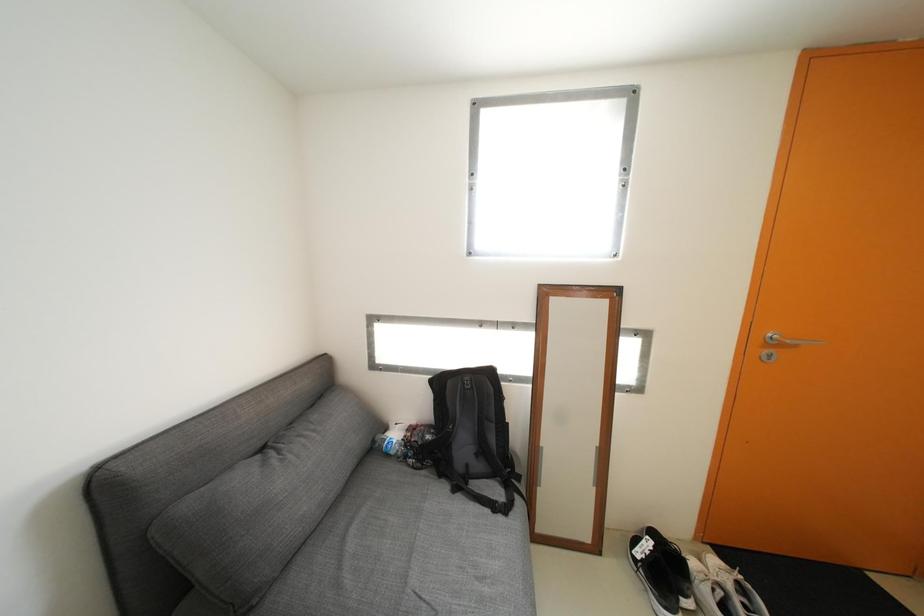
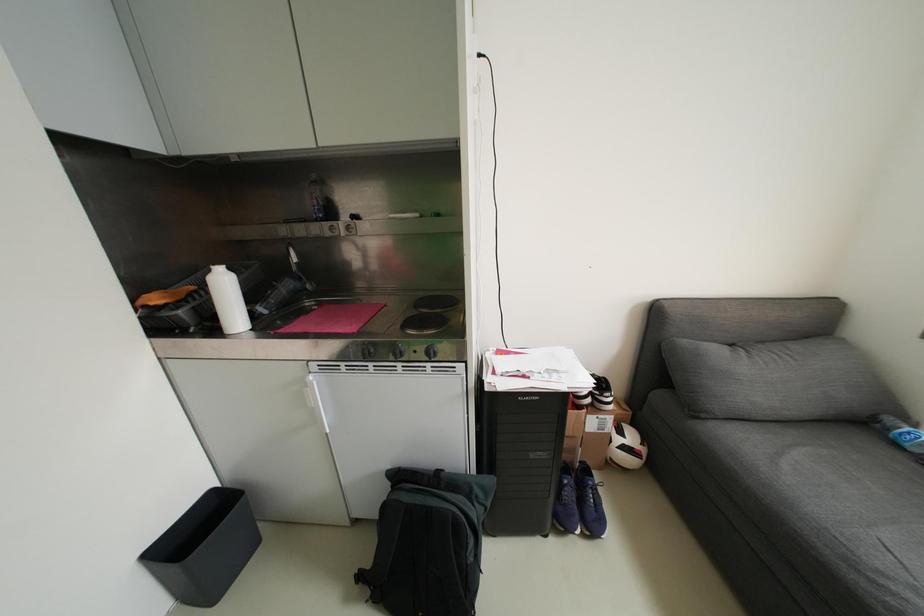
The first image is from the beginning of the video and the second image is from the end. How did the camera likely rotate when shooting the video?

The camera's rotation is toward left-down.